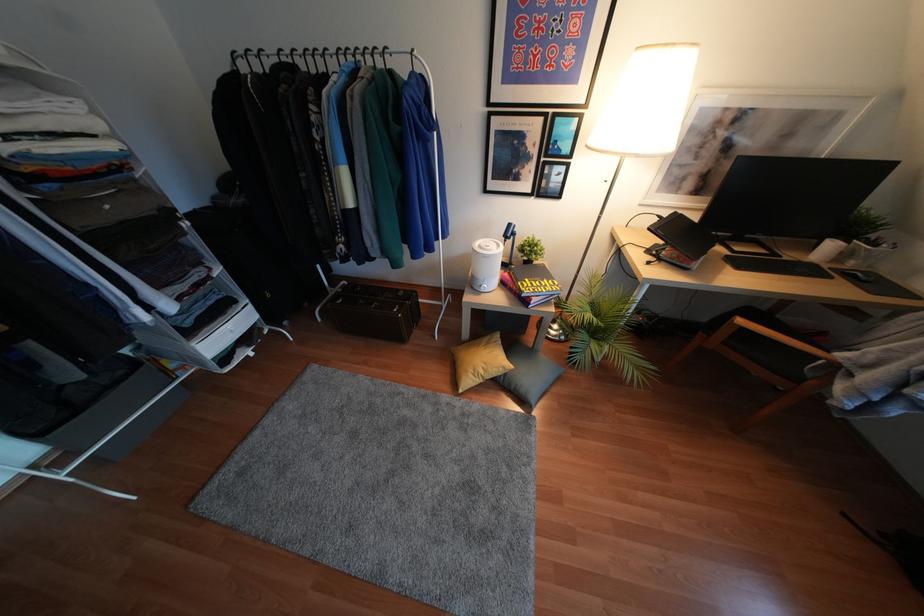
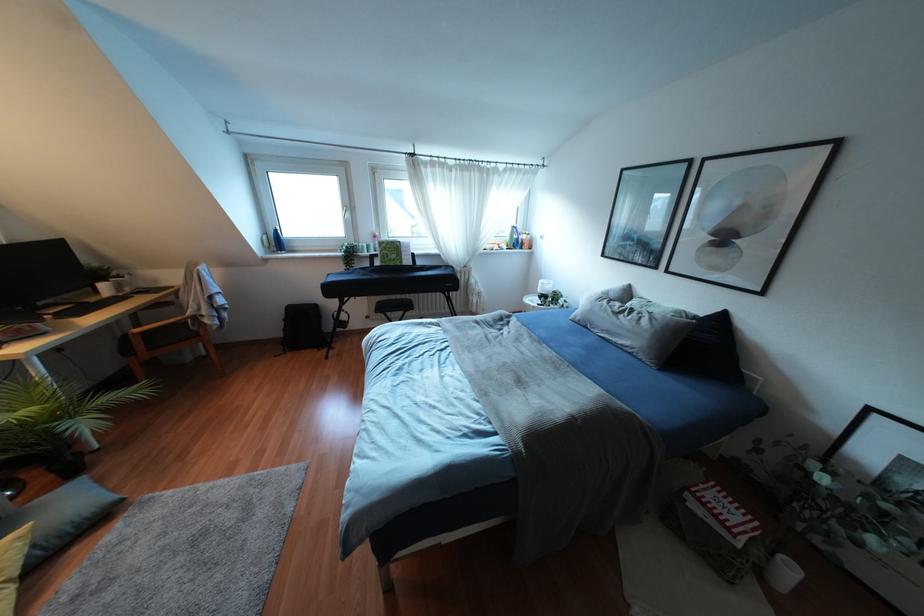
Find the pixel in the second image that matches (796,379) in the first image.

(196, 334)